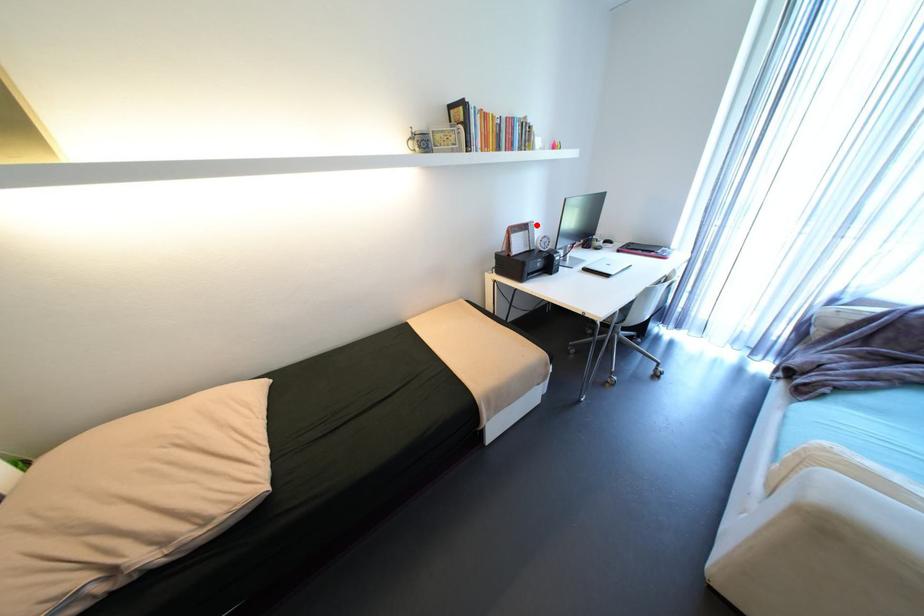
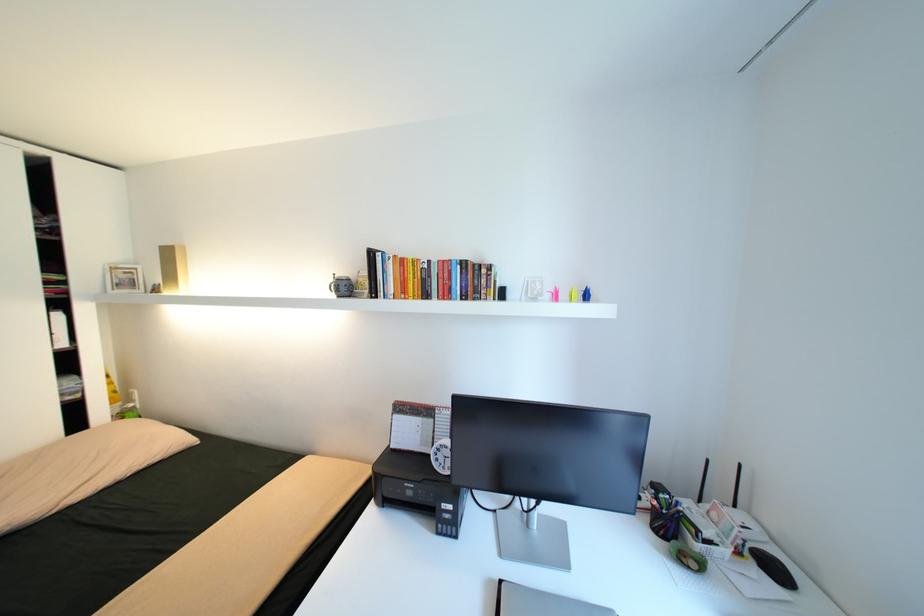
Question: I am providing you with two images of the same scene from different viewpoints. A red point is shown in image1. For the corresponding object point in image2, is it positioned nearer or farther from the camera?

Choices:
 (A) Nearer
 (B) Farther

Answer: (B)